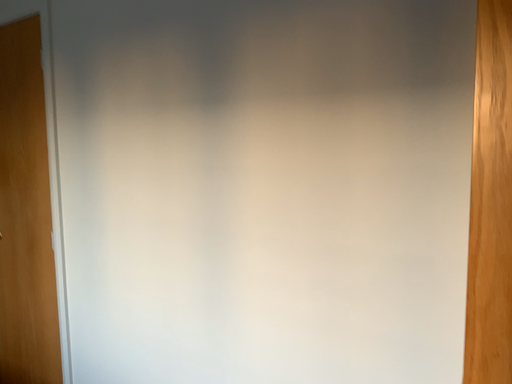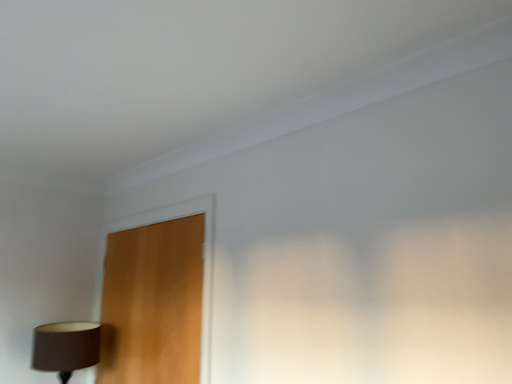
Question: How did the camera likely rotate when shooting the video?

Choices:
 (A) rotated right
 (B) rotated left

Answer: (B)